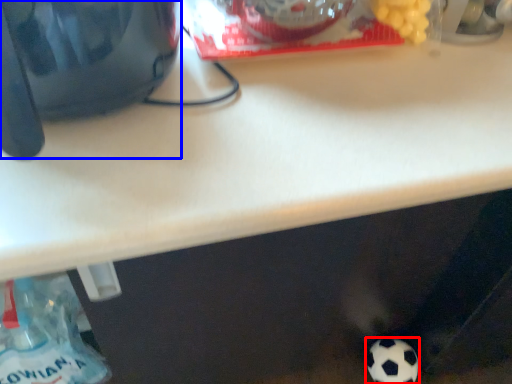
Question: Which point is closer to the camera, football (highlighted by a red box) or appliance (highlighted by a blue box)?

Choices:
 (A) football
 (B) appliance

Answer: (B)